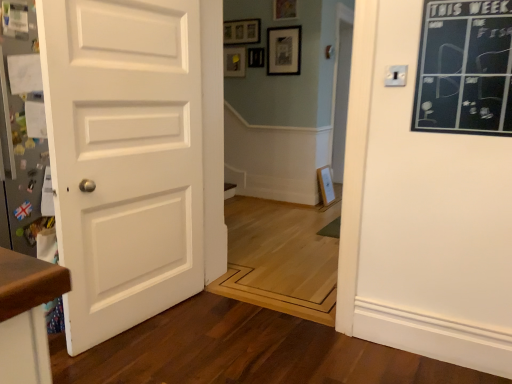
Question: Choose the correct answer: Is matte black picture frame at upper center, which appears as the third picture frame when viewed from the top, inside wooden picture frame at upper center, which is the 3th picture frame from bottom to top, or outside it?

Choices:
 (A) outside
 (B) inside

Answer: (A)

Question: Is matte black picture frame at upper center, which appears as the third picture frame when viewed from the top, wider or thinner than wooden picture frame at upper center, which is the 3th picture frame from bottom to top?

Choices:
 (A) wide
 (B) thin

Answer: (A)

Question: Estimate the real-world distances between objects in this image. Which object is closer to the wooden picture frame at upper center, placed as the first picture frame when sorted from top to bottom?

Choices:
 (A) matte black picture frame at upper center, which appears as the third picture frame when viewed from the top
 (B) black chalkboard at upper right
 (C) matte black picture frame at upper center, positioned as the 2th picture frame in bottom-to-top order
 (D) white matte door at left

Answer: (C)

Question: Which object is positioned closest to the matte black picture frame at upper center, placed as the 2th picture frame when sorted from top to bottom?

Choices:
 (A) wooden picture frame at upper center, which is the 3th picture frame from bottom to top
 (B) white matte door at left
 (C) matte black picture frame at upper center, the 1th picture frame in the bottom-to-top sequence
 (D) black chalkboard at upper right

Answer: (C)